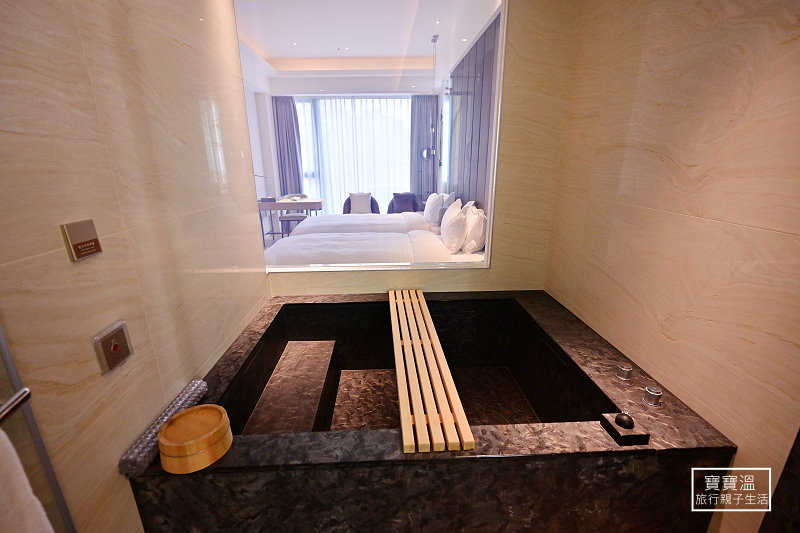
At what (x,y) coordinates should I click in order to perform the action: click on light wood grain walls. Please return your answer as a coordinate pair (x, y). The height and width of the screenshot is (533, 800). Looking at the image, I should click on coord(201,240), coord(713,351), coord(524,181).